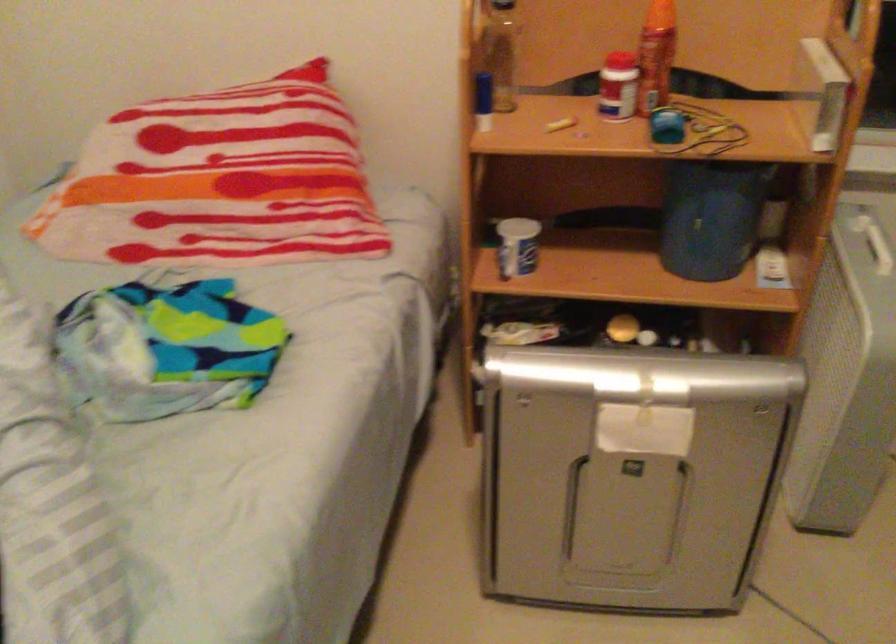
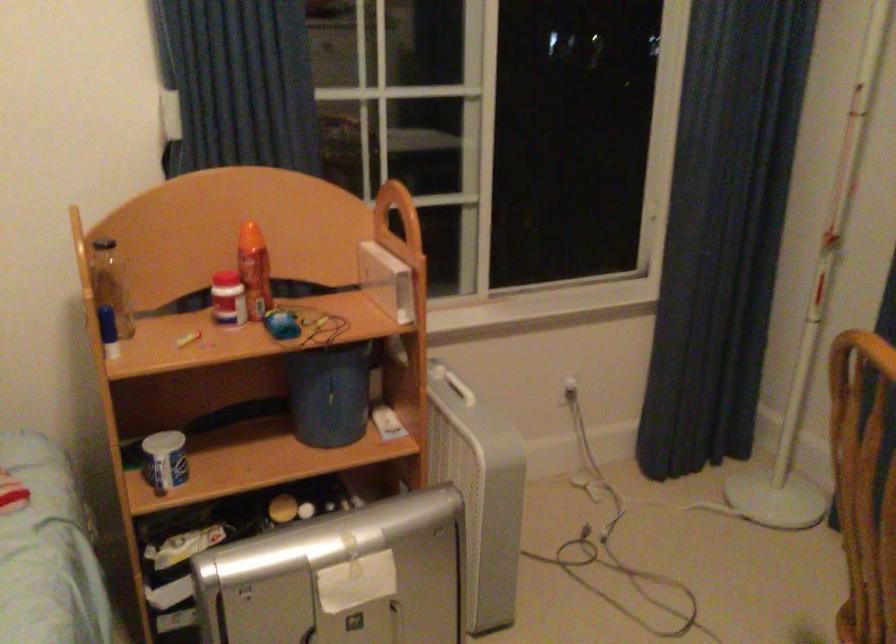
Find the pixel in the second image that matches pixel 703 218 in the first image.

(331, 395)